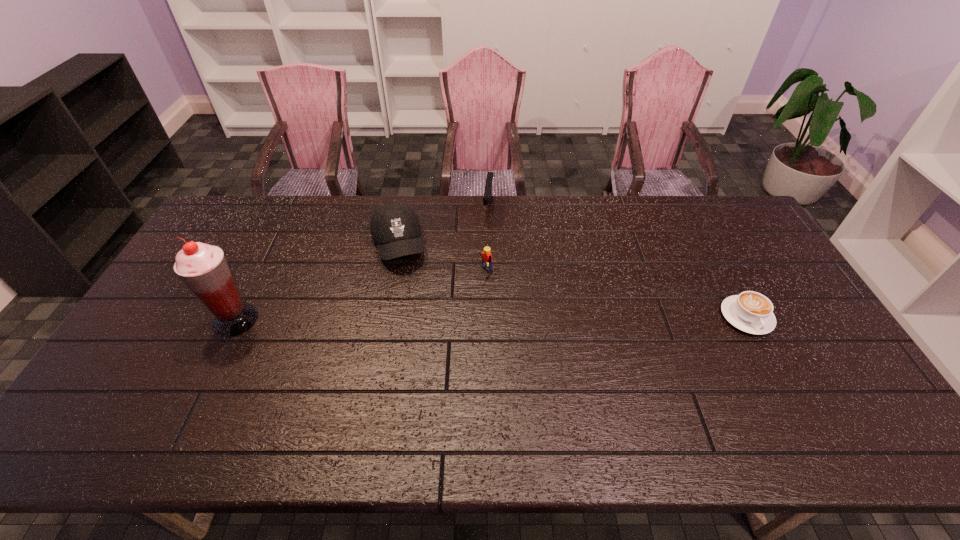
I want to click on free spot between the Lego and the pistol, so click(x=487, y=240).

The width and height of the screenshot is (960, 540). I want to click on vacant space in between the pistol and the tallest object, so click(362, 265).

At what (x,y) coordinates should I click in order to perform the action: click on vacant space in between the leftmost object and the cappuccino. Please return your answer as a coordinate pair (x, y). Looking at the image, I should click on (491, 319).

You are a GUI agent. You are given a task and a screenshot of the screen. Output one action in this format:
    pyautogui.click(x=<x>, y=<y>)
    Task: Click on the unoccupied position between the pistol and the Lego
    Image resolution: width=960 pixels, height=540 pixels.
    Given the screenshot: What is the action you would take?
    pyautogui.click(x=487, y=240)

This screenshot has width=960, height=540. I want to click on vacant area that lies between the baseball cap and the pistol, so click(444, 227).

Locate an element on the screen. The height and width of the screenshot is (540, 960). free space between the tallest object and the Lego is located at coordinates (361, 296).

This screenshot has height=540, width=960. Find the location of `free spot between the second object from left to right and the pistol`. free spot between the second object from left to right and the pistol is located at coordinates (444, 227).

At what (x,y) coordinates should I click in order to perform the action: click on object that stands as the third closest to the pistol. Please return your answer as a coordinate pair (x, y). Image resolution: width=960 pixels, height=540 pixels. Looking at the image, I should click on (751, 312).

You are a GUI agent. You are given a task and a screenshot of the screen. Output one action in this format:
    pyautogui.click(x=<x>, y=<y>)
    Task: Click on the object that is the second closest to the smoothie
    The height and width of the screenshot is (540, 960).
    Given the screenshot: What is the action you would take?
    pyautogui.click(x=486, y=256)